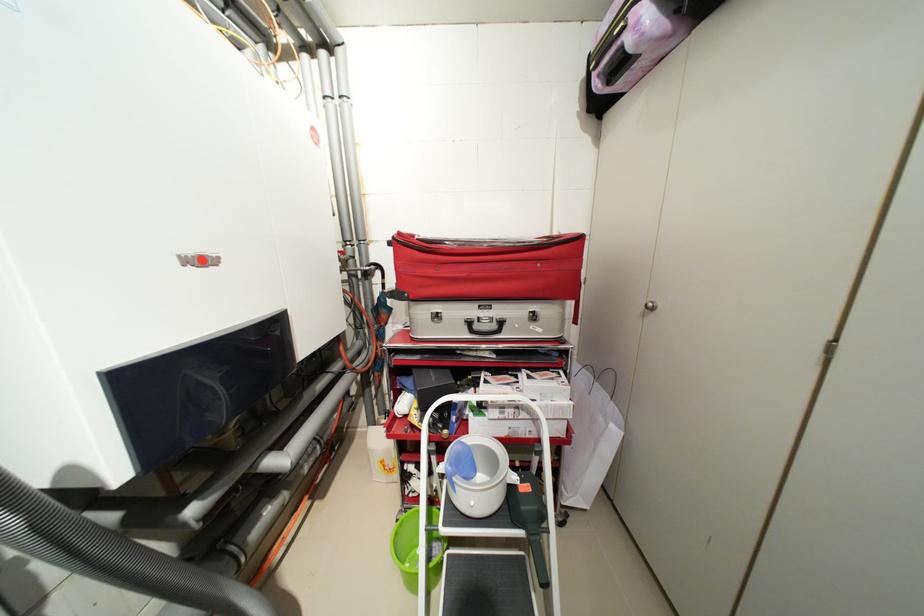
Describe the element at coordinates (113, 554) in the screenshot. I see `a patterned umbrella handle` at that location.